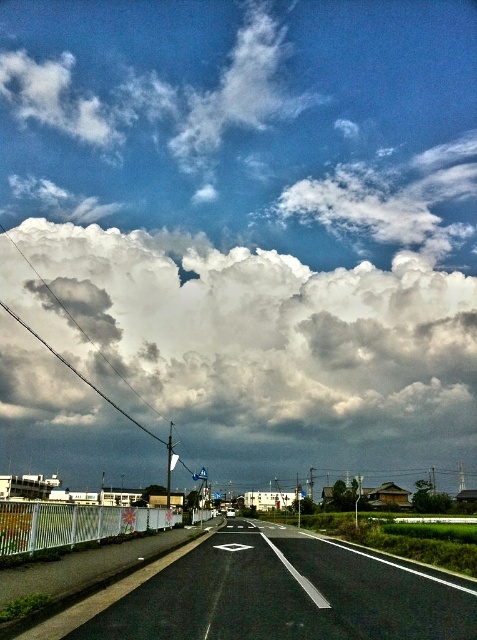
Is white fluffy cloud at upper center closer to the viewer compared to black asphalt highway at center?

No.

Is white fluffy cloud at upper center thinner than black asphalt highway at center?

No, white fluffy cloud at upper center is not thinner than black asphalt highway at center.

Find the location of a particular element. The image size is (477, 640). white fluffy cloud at upper center is located at coordinates (248, 330).